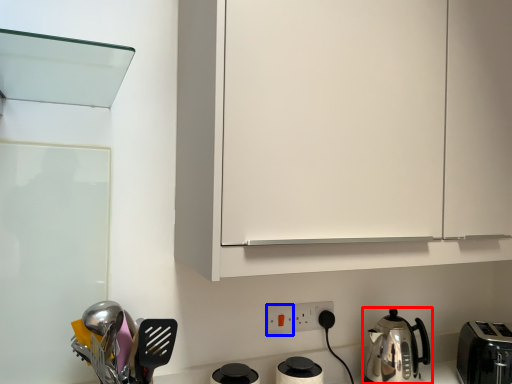
Question: Which point is further to the camera, kitchen appliance (highlighted by a red box) or electric outlet (highlighted by a blue box)?

Choices:
 (A) kitchen appliance
 (B) electric outlet

Answer: (B)